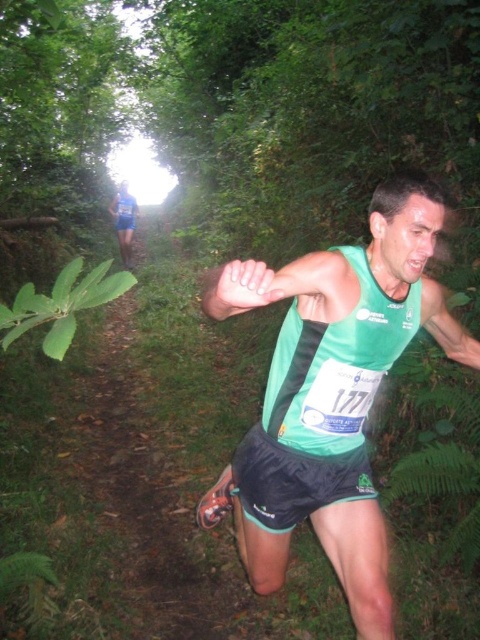
Is green fabric tank top at center thinner than black synthetic shorts at center?

In fact, green fabric tank top at center might be wider than black synthetic shorts at center.

Measure the distance between green fabric tank top at center and camera.

green fabric tank top at center and camera are 3.45 feet apart.

What are the coordinates of `green fabric tank top at center` in the screenshot? It's located at (332, 394).

Which is behind, point (384, 573) or point (119, 241)?

The point (119, 241) is more distant.

Which is in front, point (265, 288) or point (120, 252)?

Point (265, 288) is in front.

Is point (336, 410) less distant than point (130, 211)?

Yes, point (336, 410) is closer to viewer.

Where is `green fabric tank top at center`? This screenshot has width=480, height=640. green fabric tank top at center is located at coordinates (332, 394).

Can you confirm if black synthetic shorts at center is taller than blue fabric runner at upper center?

No, black synthetic shorts at center is not taller than blue fabric runner at upper center.

Between black synthetic shorts at center and blue fabric runner at upper center, which one appears on the right side from the viewer's perspective?

black synthetic shorts at center

Based on the photo, measure the distance between point (275,458) and camera.

Point (275,458) and camera are 1.87 meters apart from each other.

What are the coordinates of `black synthetic shorts at center` in the screenshot? It's located at (294, 481).